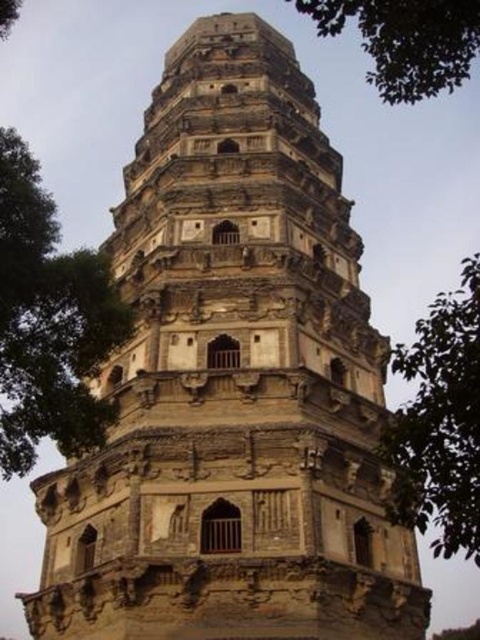
Does green leafy tree at left appear under green leafy tree at right?

Actually, green leafy tree at left is above green leafy tree at right.

Does green leafy tree at left have a greater height compared to green leafy tree at right?

In fact, green leafy tree at left may be shorter than green leafy tree at right.

Is point (88, 352) closer to viewer compared to point (423, 436)?

No, (88, 352) is further to viewer.

This screenshot has height=640, width=480. I want to click on green leafy tree at left, so click(x=48, y=323).

Who is higher up, green leafy tree at left or green leafy tree at upper center?

green leafy tree at upper center is higher up.

Consider the image. Does green leafy tree at left have a smaller size compared to green leafy tree at upper center?

Yes, green leafy tree at left is smaller than green leafy tree at upper center.

Which is in front, point (28, 374) or point (398, 84)?

Point (28, 374) is in front.

Locate an element on the screen. This screenshot has width=480, height=640. green leafy tree at left is located at coordinates (48, 323).

Who is taller, green leafy tree at right or green leafy tree at upper center?

green leafy tree at right

Which is behind, point (402, 481) or point (417, 38)?

The point (402, 481) is more distant.

You are a GUI agent. You are given a task and a screenshot of the screen. Output one action in this format:
    pyautogui.click(x=<x>, y=<y>)
    Task: Click on the green leafy tree at right
    The width and height of the screenshot is (480, 640).
    Given the screenshot: What is the action you would take?
    pyautogui.click(x=440, y=422)